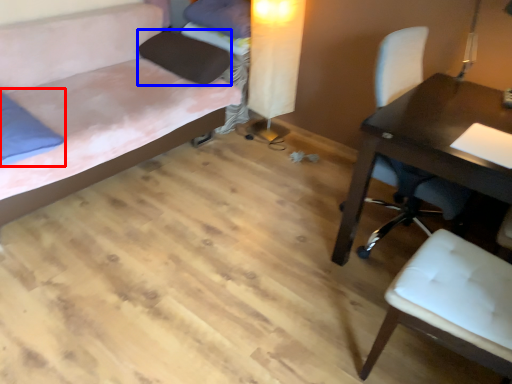
Question: Which point is further to the camera, pillow (highlighted by a red box) or pillow (highlighted by a blue box)?

Choices:
 (A) pillow
 (B) pillow

Answer: (B)